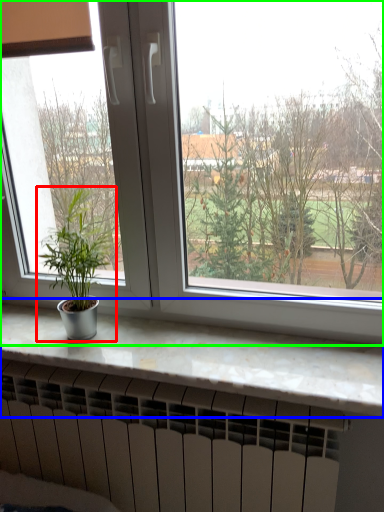
Question: Estimate the real-world distances between objects in this image. Which object is farther from houseplant (highlighted by a red box), counter top (highlighted by a blue box) or window (highlighted by a green box)?

Choices:
 (A) counter top
 (B) window

Answer: (A)